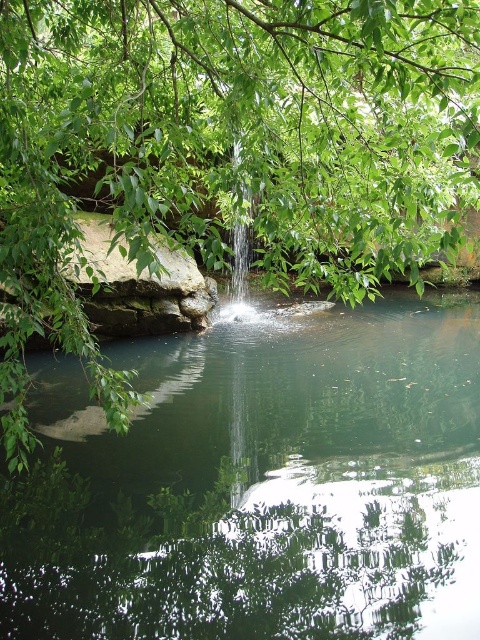
Question: Among these objects, which one is nearest to the camera?

Choices:
 (A) clear water at center
 (B) green liquid at center

Answer: (B)

Question: Which of the following is the closest to the observer?

Choices:
 (A) (216, 96)
 (B) (242, 346)
 (C) (244, 248)

Answer: (A)

Question: Can you confirm if green liquid at center is bigger than clear water at center?

Choices:
 (A) yes
 (B) no

Answer: (A)

Question: Which of the following is the closest to the observer?

Choices:
 (A) green liquid at center
 (B) clear water at center

Answer: (A)

Question: Does green liquid at center appear on the right side of green leafy tree at upper center?

Choices:
 (A) no
 (B) yes

Answer: (B)

Question: Does green leafy tree at upper center appear on the left side of clear water at center?

Choices:
 (A) yes
 (B) no

Answer: (A)